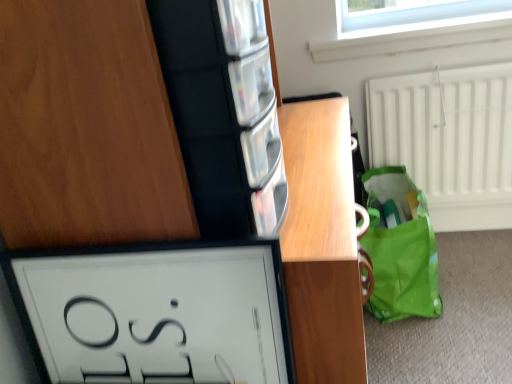
What do you see at coordinates (400, 249) in the screenshot? I see `green fabric tote at lower right` at bounding box center [400, 249].

Where is `white glossy picture frame at lower left`? The image size is (512, 384). white glossy picture frame at lower left is located at coordinates (155, 313).

Find the location of `green fabric tote at lower right`. green fabric tote at lower right is located at coordinates (400, 249).

Consider the image. Which object is positioned more to the left, white glossy picture frame at lower left or matte wood cabinet at upper left?

From the viewer's perspective, white glossy picture frame at lower left appears more on the left side.

Can you confirm if white glossy picture frame at lower left is shorter than matte wood cabinet at upper left?

Yes.

In the scene shown: How many degrees apart are the facing directions of white glossy picture frame at lower left and matte wood cabinet at upper left?

85.7 degrees separate the facing orientations of white glossy picture frame at lower left and matte wood cabinet at upper left.

This screenshot has width=512, height=384. I want to click on picture frame located below the matte wood cabinet at upper left (from the image's perspective), so click(x=155, y=313).

Which of these two, green fabric tote at lower right or clear glass window at upper center, stands taller?

green fabric tote at lower right.

From the image's perspective, who appears lower, green fabric tote at lower right or clear glass window at upper center?

green fabric tote at lower right appears lower in the image.

Does green fabric tote at lower right appear on the left side of clear glass window at upper center?

Yes.

From the picture: Does matte wood cabinet at upper left touch green fabric tote at lower right?

No, matte wood cabinet at upper left is not beside green fabric tote at lower right.

Is matte wood cabinet at upper left shorter than green fabric tote at lower right?

Yes.

Looking at their sizes, would you say matte wood cabinet at upper left is wider or thinner than green fabric tote at lower right?

In the image, matte wood cabinet at upper left appears to be wider than green fabric tote at lower right.

Can you tell me how much green fabric tote at lower right and matte wood cabinet at upper left differ in facing direction?

1.25 degrees separate the facing orientations of green fabric tote at lower right and matte wood cabinet at upper left.

From the image's perspective, is green fabric tote at lower right located above matte wood cabinet at upper left?

No, from the image's perspective, green fabric tote at lower right is not on top of matte wood cabinet at upper left.

Which of these two, green fabric tote at lower right or matte wood cabinet at upper left, is smaller?

matte wood cabinet at upper left.

In the scene shown: Would you say green fabric tote at lower right is inside or outside matte wood cabinet at upper left?

green fabric tote at lower right is located beyond the bounds of matte wood cabinet at upper left.

From the image's perspective, is matte wood cabinet at upper left over white glossy picture frame at lower left?

Correct, matte wood cabinet at upper left appears higher than white glossy picture frame at lower left in the image.

Does matte wood cabinet at upper left have a larger size compared to white glossy picture frame at lower left?

Yes, matte wood cabinet at upper left is bigger than white glossy picture frame at lower left.

Which of these two, matte wood cabinet at upper left or white glossy picture frame at lower left, stands shorter?

white glossy picture frame at lower left.

Is matte wood cabinet at upper left aimed at white glossy picture frame at lower left?

No, matte wood cabinet at upper left is not aimed at white glossy picture frame at lower left.

Which is behind, point (219, 259) or point (422, 251)?

The point (422, 251) is farther from the camera.

Considering the relative positions of white glossy picture frame at lower left and green fabric tote at lower right in the image provided, is white glossy picture frame at lower left to the left of green fabric tote at lower right from the viewer's perspective?

Yes, white glossy picture frame at lower left is to the left of green fabric tote at lower right.

Are white glossy picture frame at lower left and green fabric tote at lower right far apart?

That's not correct — white glossy picture frame at lower left is a little close to green fabric tote at lower right.

Can green fabric tote at lower right be found inside white glossy picture frame at lower left?

Definitely not — green fabric tote at lower right is not inside white glossy picture frame at lower left.

Which of these two, clear glass window at upper center or wooden vanity at center, stands taller?

wooden vanity at center.

From a real-world perspective, between clear glass window at upper center and wooden vanity at center, who is vertically higher?

clear glass window at upper center is physically above.

Does clear glass window at upper center appear on the left side of wooden vanity at center?

No.

Find the location of a particular element. The width and height of the screenshot is (512, 384). picture frame located below the matte wood cabinet at upper left (from the image's perspective) is located at coordinates (155, 313).

The height and width of the screenshot is (384, 512). What are the coordinates of `window above the green fabric tote at lower right (from a real-world perspective)` in the screenshot? It's located at (414, 29).

From the image, which object appears to be nearer to wooden vanity at center, clear glass window at upper center or matte wood cabinet at upper left?

matte wood cabinet at upper left lies closer to wooden vanity at center than the other object.

Considering their positions, is green fabric tote at lower right positioned further to wooden vanity at center than matte wood cabinet at upper left?

green fabric tote at lower right is further to wooden vanity at center.

From the image, which object appears to be nearer to matte wood cabinet at upper left, white glossy picture frame at lower left or clear glass window at upper center?

Among the two, white glossy picture frame at lower left is located nearer to matte wood cabinet at upper left.

Based on their spatial positions, is clear glass window at upper center or wooden vanity at center closer to matte wood cabinet at upper left?

wooden vanity at center is closer to matte wood cabinet at upper left.

When comparing their distances from clear glass window at upper center, does green fabric tote at lower right or wooden vanity at center seem further?

wooden vanity at center is positioned further to the anchor clear glass window at upper center.

From the image, which object appears to be nearer to green fabric tote at lower right, wooden vanity at center or matte wood cabinet at upper left?

wooden vanity at center is closer to green fabric tote at lower right.

From the image, which object appears to be nearer to green fabric tote at lower right, matte wood cabinet at upper left or clear glass window at upper center?

clear glass window at upper center.

From the image, which object appears to be farther from white glossy picture frame at lower left, clear glass window at upper center or green fabric tote at lower right?

clear glass window at upper center lies further to white glossy picture frame at lower left than the other object.

This screenshot has height=384, width=512. What are the coordinates of `picture frame between matte wood cabinet at upper left and green fabric tote at lower right in the front-back direction` in the screenshot? It's located at (155, 313).

This screenshot has height=384, width=512. I want to click on cabinetry between wooden vanity at center and green fabric tote at lower right from front to back, so click(x=86, y=127).

Identify the location of picture frame positioned between wooden vanity at center and clear glass window at upper center from near to far. This screenshot has height=384, width=512. (155, 313).

Find the location of a particular element. This screenshot has width=512, height=384. vanity between matte wood cabinet at upper left and white glossy picture frame at lower left in the up-down direction is located at coordinates (322, 244).